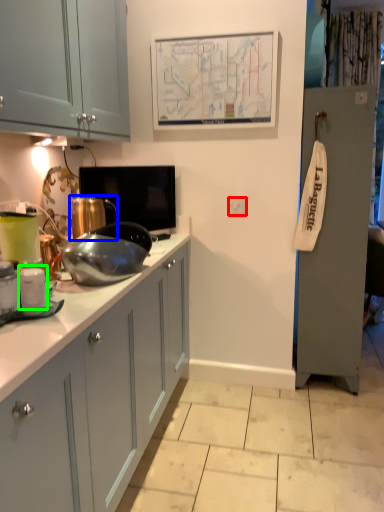
Question: Based on their relative distances, which object is nearer to electric outlet (highlighted by a red box)? Choose from appliance (highlighted by a blue box) and appliance (highlighted by a green box).

Choices:
 (A) appliance
 (B) appliance

Answer: (A)